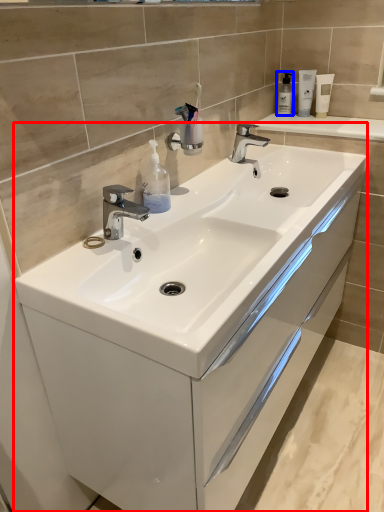
Question: Which point is further to the camera, bathroom cabinet (highlighted by a red box) or soap dispenser (highlighted by a blue box)?

Choices:
 (A) bathroom cabinet
 (B) soap dispenser

Answer: (B)